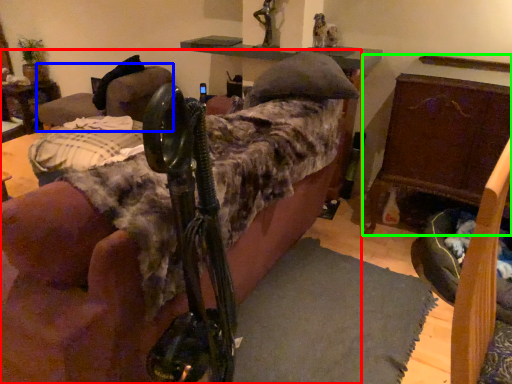
Question: Estimate the real-world distances between objects in this image. Which object is closer to furniture (highlighted by a red box), swivel chair (highlighted by a blue box) or furniture (highlighted by a green box)?

Choices:
 (A) swivel chair
 (B) furniture

Answer: (B)